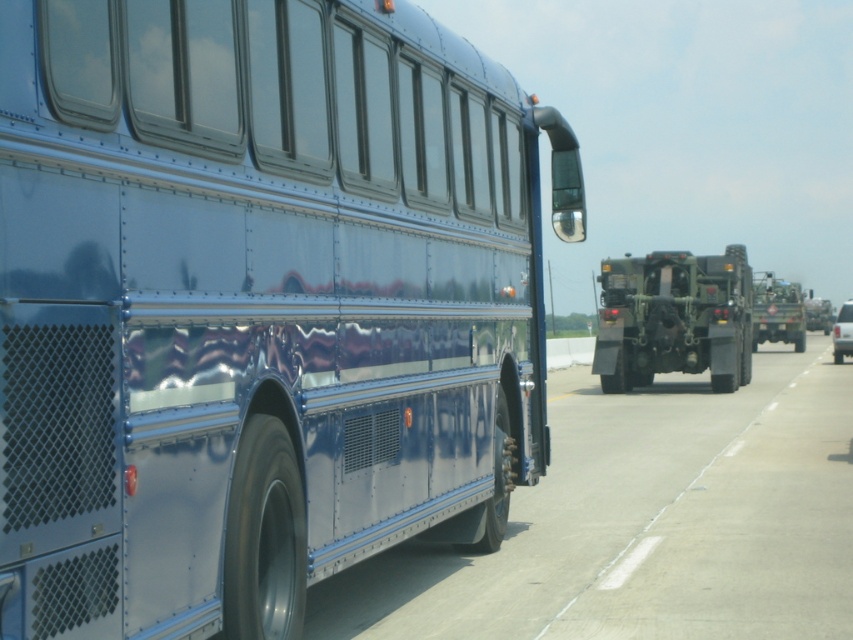
Question: Can you confirm if glossy blue bus at center is positioned to the right of matte green military vehicle at center?

Choices:
 (A) yes
 (B) no

Answer: (B)

Question: Is glossy blue bus at center to the right of matte green military vehicle at center from the viewer's perspective?

Choices:
 (A) no
 (B) yes

Answer: (A)

Question: Which point is farther to the camera?

Choices:
 (A) (318, 275)
 (B) (611, 342)

Answer: (B)

Question: Which point is farther to the camera?

Choices:
 (A) (712, 376)
 (B) (54, 250)

Answer: (A)

Question: Is glossy blue bus at center thinner than matte green military vehicle at center?

Choices:
 (A) no
 (B) yes

Answer: (B)

Question: Which point is farther from the camera taking this photo?

Choices:
 (A) (746, 291)
 (B) (387, 536)

Answer: (A)